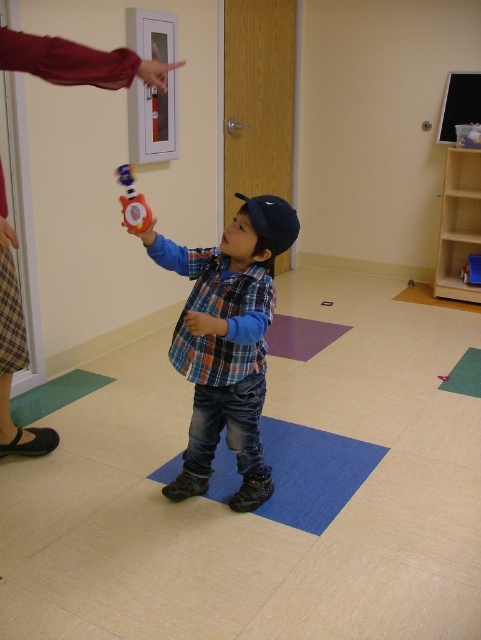
Based on the scene, which object is positioned to the right when comparing the plaid shirt at center and the rubberized red fire extinguisher at center?

The plaid shirt at center is positioned to the right of the rubberized red fire extinguisher at center according to the description.

You are a photographer setting up for a classroom photo shoot. You need to position two markers at the coordinates point (x=240, y=269) and point (x=126, y=179). Which marker should you place first if you want to start from the closest point to the camera and move towards the furthest?

You should place the marker at point (x=126, y=179) first because it is closer to the camera than point (x=240, y=269), which is further away.

You are a photographer positioned in the classroom. You need to take a photo that includes both the plaid shirt at center and the rubberized red fire extinguisher at center. Can you ensure both are visible in the frame without moving any objects?

The plaid shirt at center is in front of the rubberized red fire extinguisher at center, so as long as the camera angle allows both to be visible without obstruction, both can be included in the frame without moving any objects.